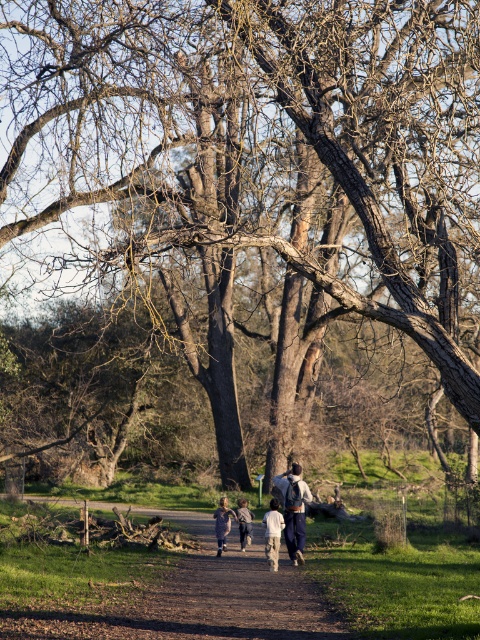
You are standing at the point with coordinates point (241, 499) and want to walk to the point with coordinates point (197, 582). According to the scene description, which direction should you face to walk towards your destination?

You should face forward because point (197, 582) is in front of point (241, 499).